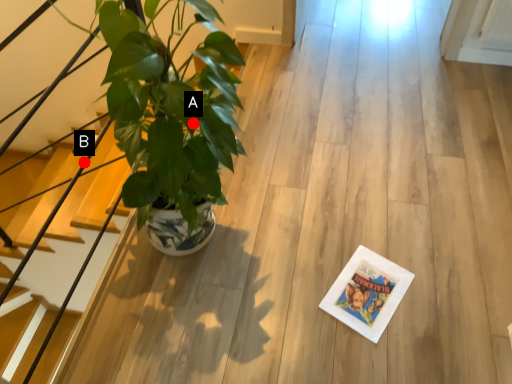
Question: Two points are circled on the image, labeled by A and B beside each circle. Among these points, which one is farthest from the camera?

Choices:
 (A) A is further
 (B) B is further

Answer: (B)